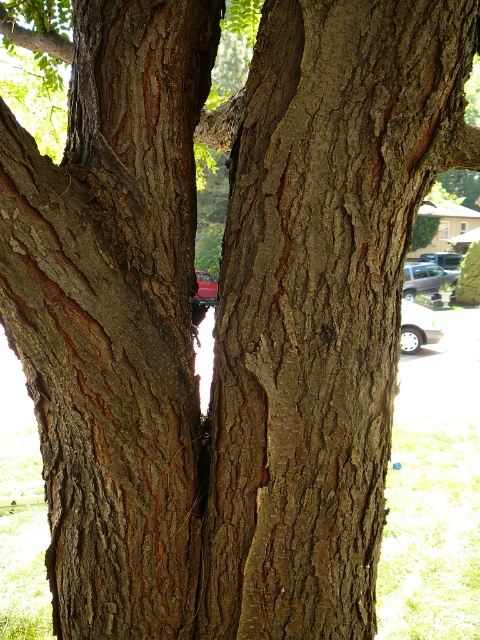
Question: Can you confirm if smooth brown bark at center is smaller than silver metallic car at right?

Choices:
 (A) no
 (B) yes

Answer: (B)

Question: In this image, where is silver metallic car at center located relative to metallic silver car at center?

Choices:
 (A) below
 (B) above

Answer: (A)

Question: Which of the following is the closest to the observer?

Choices:
 (A) (201, 296)
 (B) (428, 324)

Answer: (A)

Question: Where is smooth brown bark at center located in relation to silver metallic car at right in the image?

Choices:
 (A) below
 (B) above

Answer: (A)

Question: Which object is the closest to the metallic silver car at center?

Choices:
 (A) silver metallic car at center
 (B) silver metallic car at right
 (C) smooth brown bark at center

Answer: (A)

Question: Which point appears closest to the camera in this image?

Choices:
 (A) tap(432, 275)
 (B) tap(454, 262)
 (C) tap(434, 324)

Answer: (C)